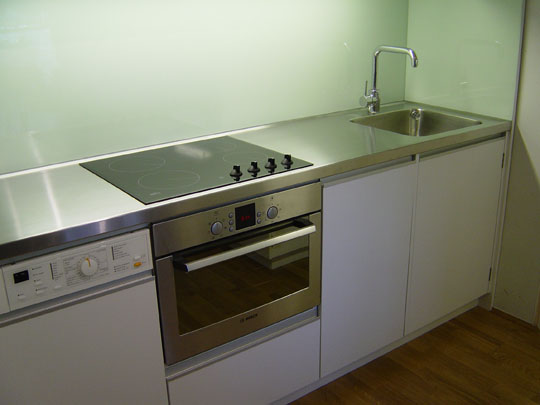
In order to click on sink basin in this screenshot , I will do `click(414, 122)`.